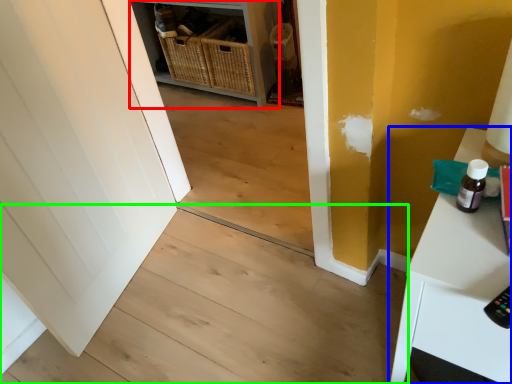
Question: Which object is positioned closest to shelf (highlighted by a red box)? Select from table (highlighted by a blue box) and stair (highlighted by a green box).

Choices:
 (A) table
 (B) stair

Answer: (B)